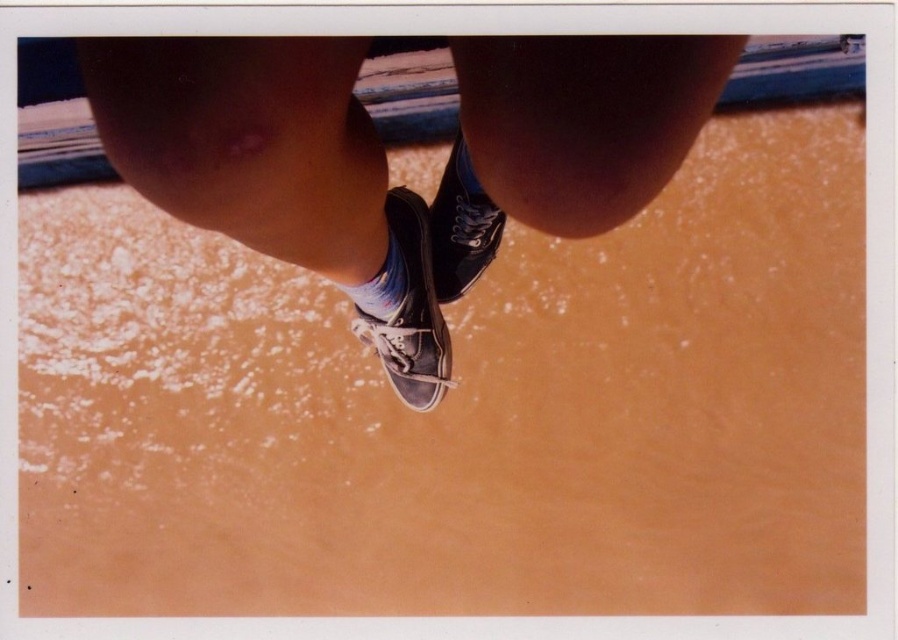
You are a photographer trying to capture a closeup of both the matte black sneaker at center and the multicolored fabric sock at center in the image. Given that your camera can focus on objects within a 10 centimeter range, will you be able to capture both items clearly in the same shot?

The matte black sneaker at center and multicolored fabric sock at center are 11.21 centimeters apart from each other. Since the camera can only focus within a 10 centimeter range, the distance between them exceeds the focus range. Therefore, you cannot capture both items clearly in the same shot.

You are a photographer positioned at ground level, capturing the scene from a low angle. You notice the black canvas shoe at center and the matte black sneaker at center. Which shoe appears larger in your photo due to perspective?

The black canvas shoe at center appears larger in the photo because it is closer to the viewer than the matte black sneaker at center.

You are a photographer trying to capture a closeup shot of the matte black sneaker at center and the multicolored fabric sock at center. Since you want to focus on the sneaker, which object should you adjust your camera focus to prioritize and why?

The matte black sneaker at center is taller than the multicolored fabric sock at center, so you should prioritize focusing on the matte black sneaker at center because it occupies more vertical space in the frame.